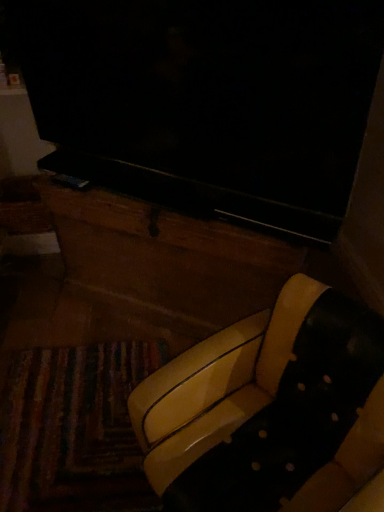
What do you see at coordinates (269, 409) in the screenshot? I see `leather armchair at lower right` at bounding box center [269, 409].

What are the coordinates of `leather armchair at lower right` in the screenshot? It's located at (269, 409).

Find the location of a particular element. This screenshot has height=512, width=384. leather armchair at lower right is located at coordinates (269, 409).